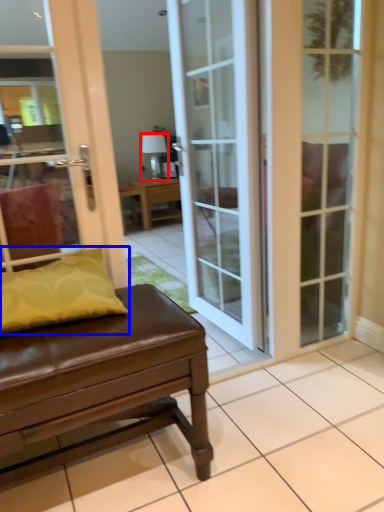
Question: Among these objects, which one is nearest to the camera, lamp (highlighted by a red box) or pillow (highlighted by a blue box)?

Choices:
 (A) lamp
 (B) pillow

Answer: (B)